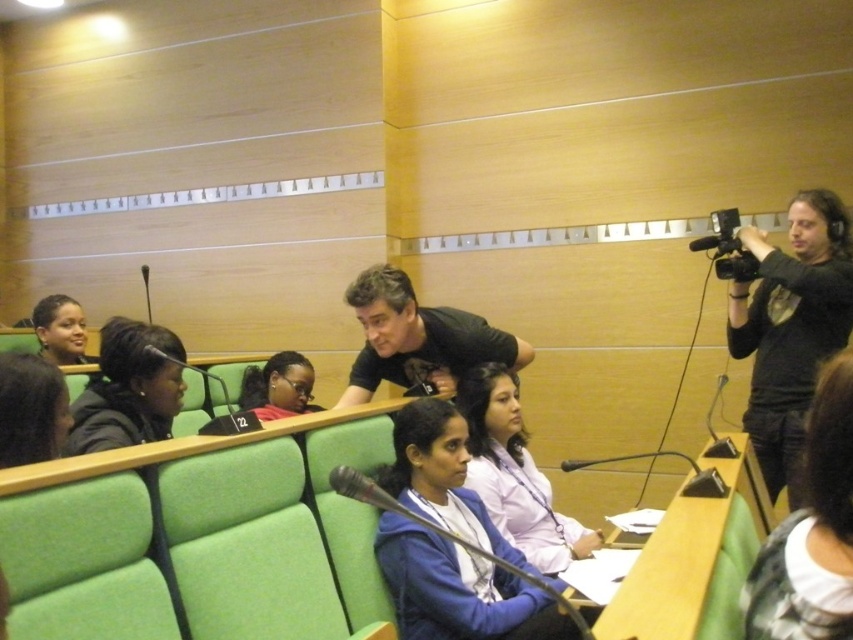
Question: Among these objects, which one is farthest from the camera?

Choices:
 (A) black matte shirt at center
 (B) matte black jacket at lower left
 (C) black plastic video camera at upper right
 (D) black matte camera at right

Answer: (C)

Question: Can you confirm if black matte shirt at center is bigger than black plastic video camera at upper right?

Choices:
 (A) yes
 (B) no

Answer: (A)

Question: Can you confirm if matte black jacket at lower left is thinner than black plastic video camera at upper right?

Choices:
 (A) no
 (B) yes

Answer: (A)

Question: Which point is farther to the camera?

Choices:
 (A) light purple shirt at center
 (B) matte black woman at lower left

Answer: (B)

Question: Is black matte shirt at center in front of matte black woman at lower left?

Choices:
 (A) no
 (B) yes

Answer: (B)

Question: Among these objects, which one is nearest to the camera?

Choices:
 (A) black matte shirt at center
 (B) light purple shirt at center

Answer: (B)